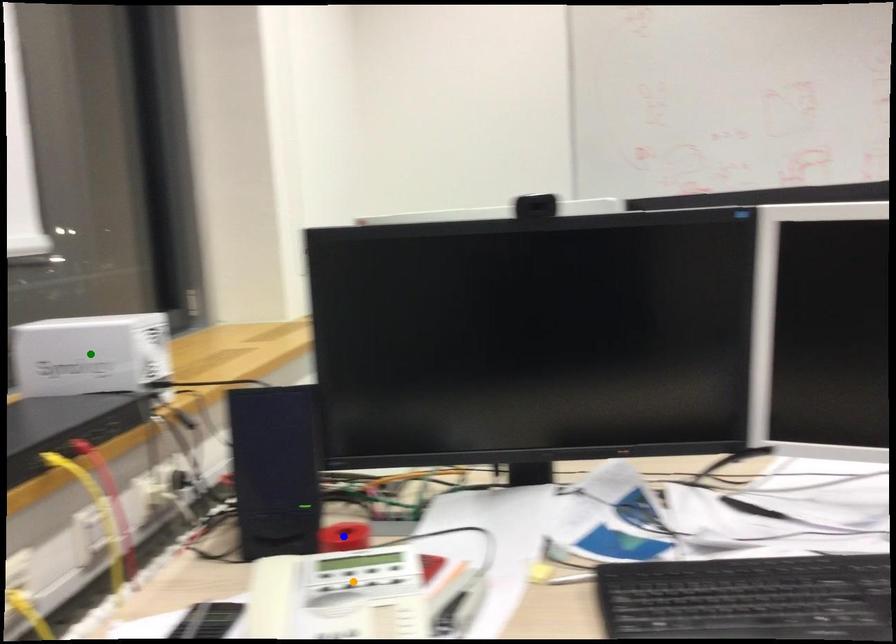
Order these from nearest to farthest:
green point, blue point, orange point

green point
blue point
orange point